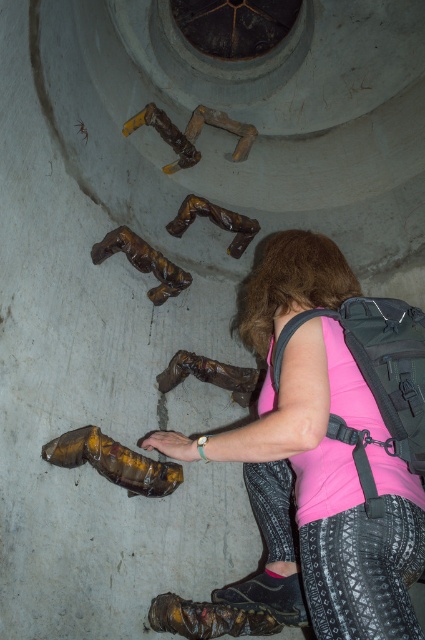
In the scene shown: You are a hiker who needs to decide which backpack to take. The pink fabric backpack at lower center and the matte black backpack at center are both available. Based on their sizes, which one has more vertical space for items?

The pink fabric backpack at lower center is taller than the matte black backpack at center, so it has more vertical space for items.

You are a hiker who has just entered the cylindrical structure. You see the matte black backpack at center and the leather glove at lower center. Which object is closer to the right side of the structure?

The matte black backpack at center is to the right of the leather glove at lower center, so it is closer to the right side of the structure.

You are a hiker who just entered this cylindrical structure and see the matte black backpack at center and the leather glove at lower center. Which object is higher up on the wall?

The matte black backpack at center is much taller than the leather glove at lower center, so the matte black backpack at center is higher up on the wall.